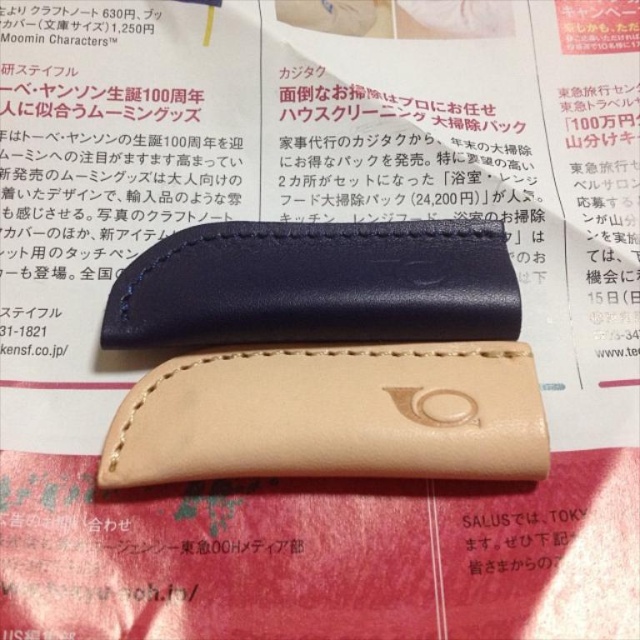
Question: Does tan leather case at center have a lesser width compared to matte black leather case at upper center?

Choices:
 (A) no
 (B) yes

Answer: (A)

Question: In this image, where is tan leather case at center located relative to matte black leather case at upper center?

Choices:
 (A) below
 (B) above

Answer: (A)

Question: Is tan leather case at center wider than matte black leather case at upper center?

Choices:
 (A) yes
 (B) no

Answer: (A)

Question: Which object is farther from the camera taking this photo?

Choices:
 (A) matte black leather case at upper center
 (B) tan leather case at center

Answer: (A)

Question: Which object appears farthest from the camera in this image?

Choices:
 (A) tan leather case at center
 (B) matte black leather case at upper center

Answer: (B)